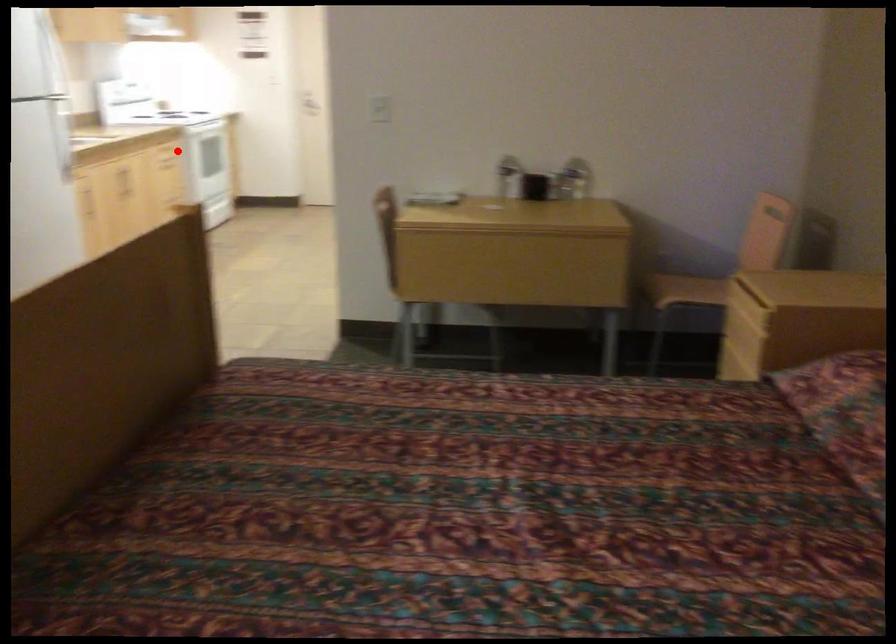
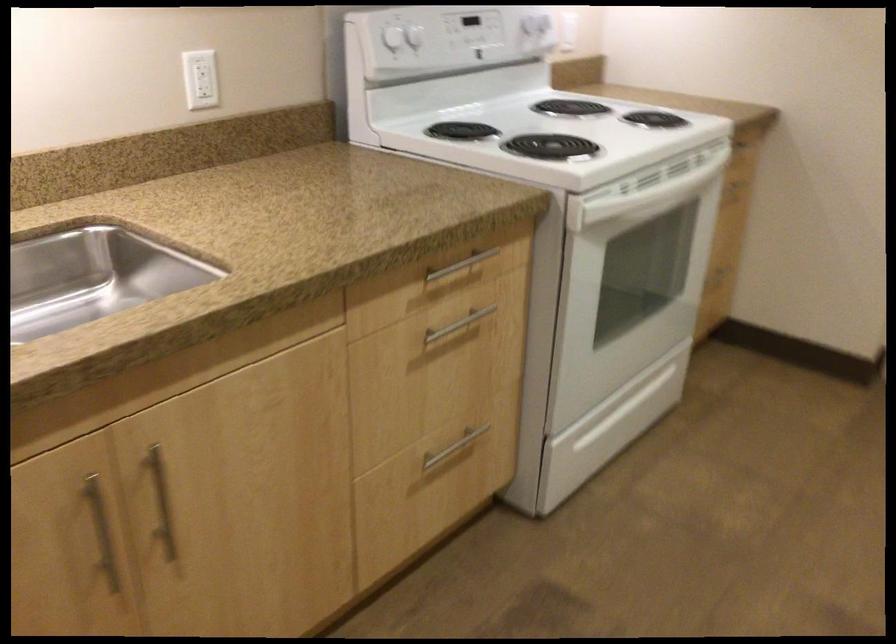
Question: I am providing you with two images of the same scene from different viewpoints. A red point is marked on the first image. Can you still see the location of the red point in image 2?

Choices:
 (A) Yes
 (B) No

Answer: (A)